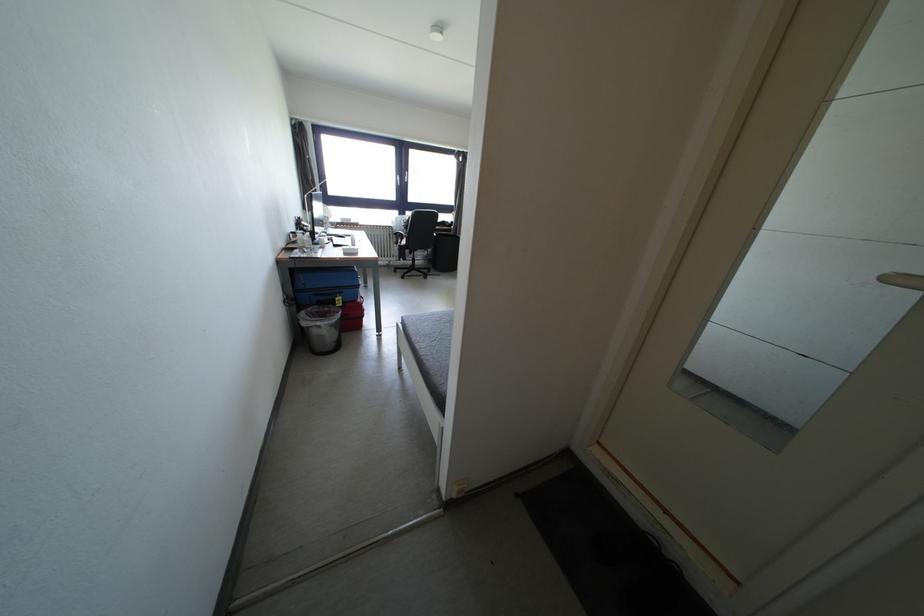
Find the location of a particular element. chair sitting surface is located at coordinates coord(410,241).